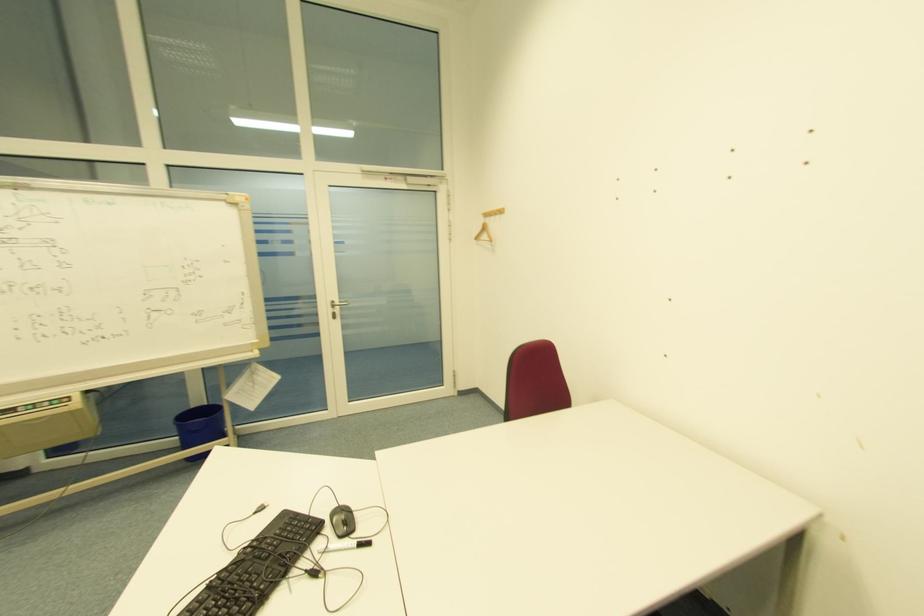
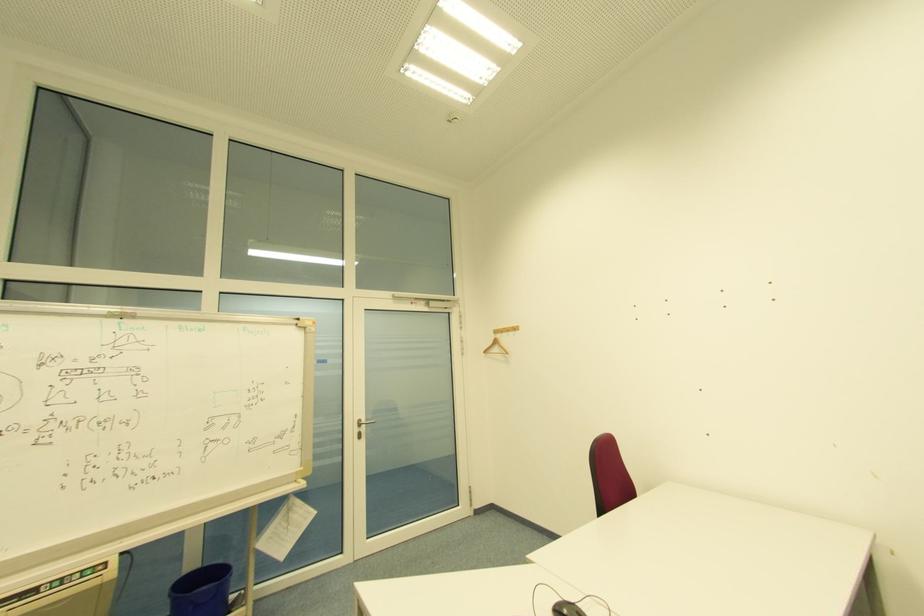
Question: The images are taken continuously from a first-person perspective. In which direction are you moving?

Choices:
 (A) Left
 (B) Right
 (C) Forward
 (D) Backward

Answer: (A)